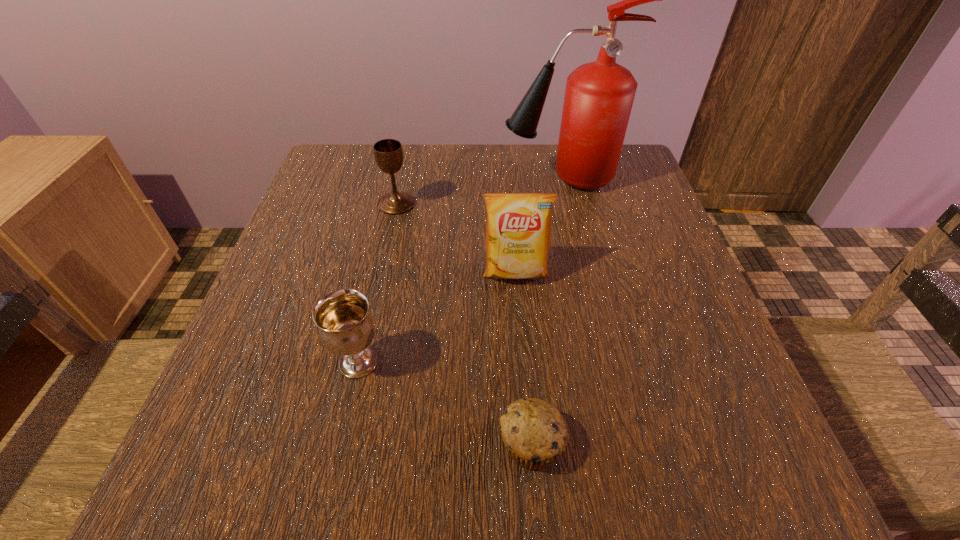
Locate an element on the screen. This screenshot has height=540, width=960. blank area at the left edge is located at coordinates (308, 212).

This screenshot has height=540, width=960. What are the coordinates of `free location at the right edge of the desktop` in the screenshot? It's located at (660, 250).

In the image, there is a desktop. Where is `vacant region at the far left corner`? The height and width of the screenshot is (540, 960). vacant region at the far left corner is located at coordinates (355, 163).

Locate an element on the screen. free space at the far right corner of the desktop is located at coordinates (631, 148).

In the image, there is a desktop. Where is `free space at the near right corner`? free space at the near right corner is located at coordinates (733, 446).

Locate an element on the screen. This screenshot has height=540, width=960. free space between the tallest object and the nearer chalice is located at coordinates (459, 271).

Identify the location of vacant area between the farther chalice and the nearer chalice. This screenshot has width=960, height=540. (378, 283).

This screenshot has width=960, height=540. I want to click on empty space that is in between the farther chalice and the tallest object, so click(x=478, y=191).

At what (x,y) coordinates should I click in order to perform the action: click on free point between the shortest object and the crisp (potato chip). Please return your answer as a coordinate pair (x, y). This screenshot has width=960, height=540. Looking at the image, I should click on (523, 358).

This screenshot has width=960, height=540. Find the location of `free space between the third nearest object and the second nearest object`. free space between the third nearest object and the second nearest object is located at coordinates (437, 318).